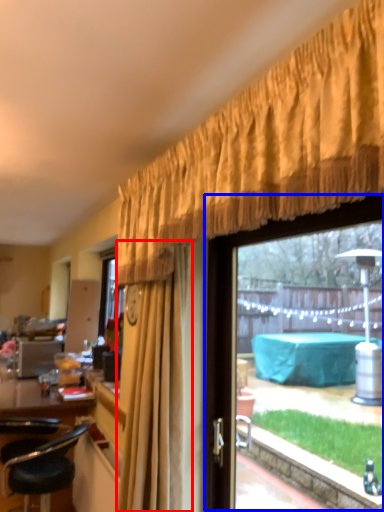
Question: Among these objects, which one is nearest to the camera, curtain (highlighted by a red box) or window (highlighted by a blue box)?

Choices:
 (A) curtain
 (B) window

Answer: (B)